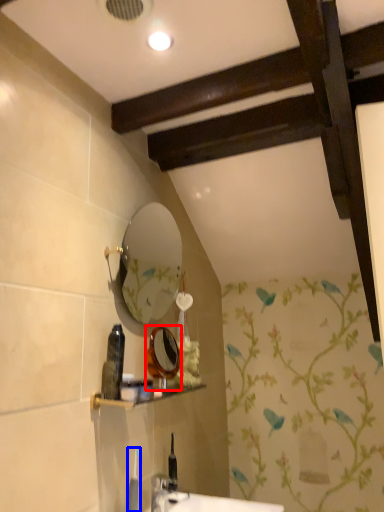
Question: Among these objects, which one is farthest to the camera, mirror (highlighted by a red box) or toiletry (highlighted by a blue box)?

Choices:
 (A) mirror
 (B) toiletry

Answer: (A)